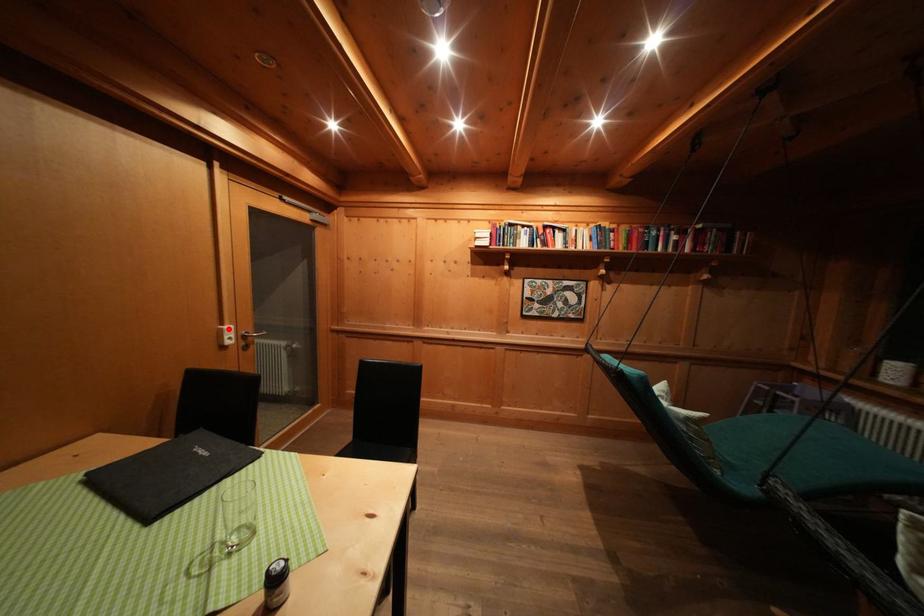
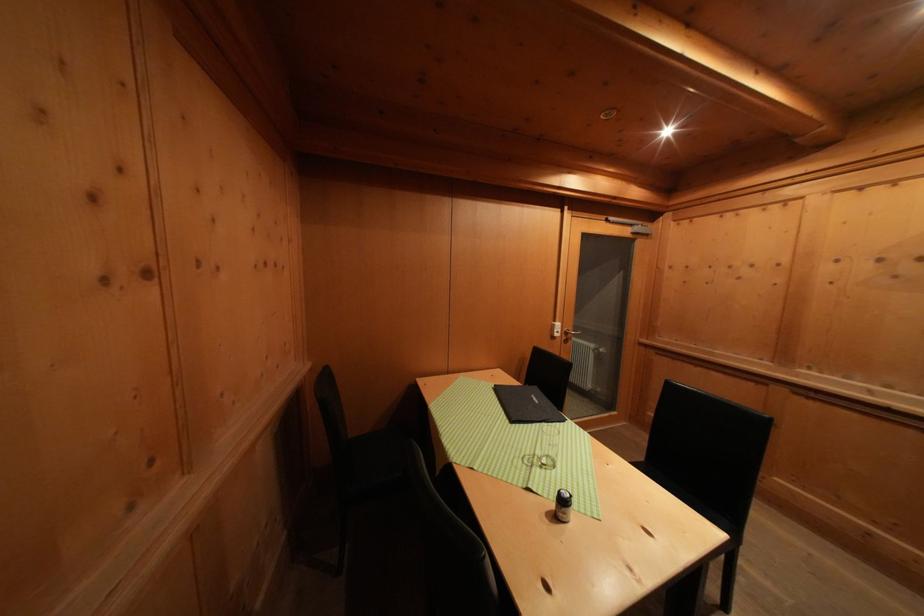
In the second image, find the point that corresponds to the highlighted location in the first image.

(561, 326)